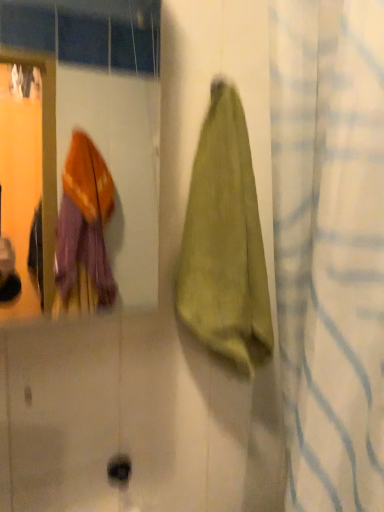
Question: From a real-world perspective, relative to green fabric towel at center, is green fabric towel at right vertically above or below?

Choices:
 (A) below
 (B) above

Answer: (A)

Question: In terms of height, does green fabric towel at right look taller or shorter compared to green fabric towel at center?

Choices:
 (A) tall
 (B) short

Answer: (A)

Question: From the image's perspective, relative to green fabric towel at center, is green fabric towel at right above or below?

Choices:
 (A) above
 (B) below

Answer: (B)

Question: Is green fabric towel at center to the left or to the right of green fabric towel at right in the image?

Choices:
 (A) right
 (B) left

Answer: (B)

Question: From their relative heights in the image, would you say green fabric towel at center is taller or shorter than green fabric towel at right?

Choices:
 (A) tall
 (B) short

Answer: (B)

Question: Is point (258, 273) positioned closer to the camera than point (375, 79)?

Choices:
 (A) closer
 (B) farther

Answer: (B)

Question: In terms of size, does green fabric towel at center appear bigger or smaller than green fabric towel at right?

Choices:
 (A) big
 (B) small

Answer: (B)